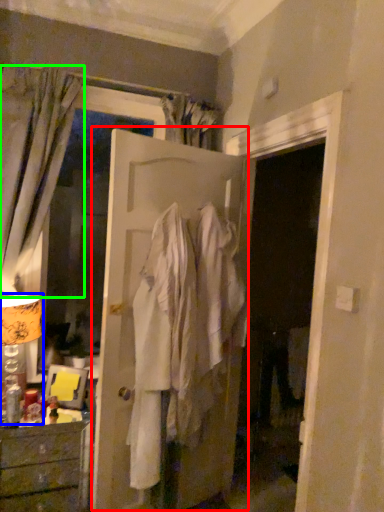
Question: Based on their relative distances, which object is nearer to door (highlighted by a red box)? Choose from table lamp (highlighted by a blue box) and curtain (highlighted by a green box).

Choices:
 (A) table lamp
 (B) curtain

Answer: (B)